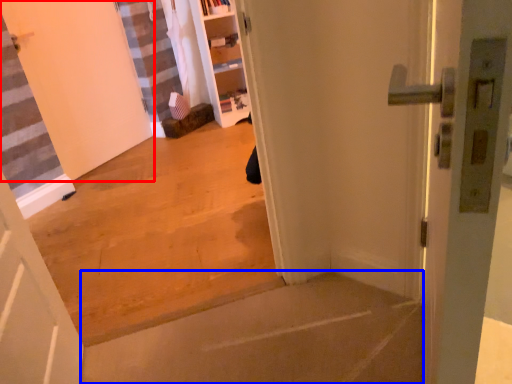
Question: Which of the following is the closest to the observer, door (highlighted by a red box) or concrete (highlighted by a blue box)?

Choices:
 (A) door
 (B) concrete

Answer: (B)